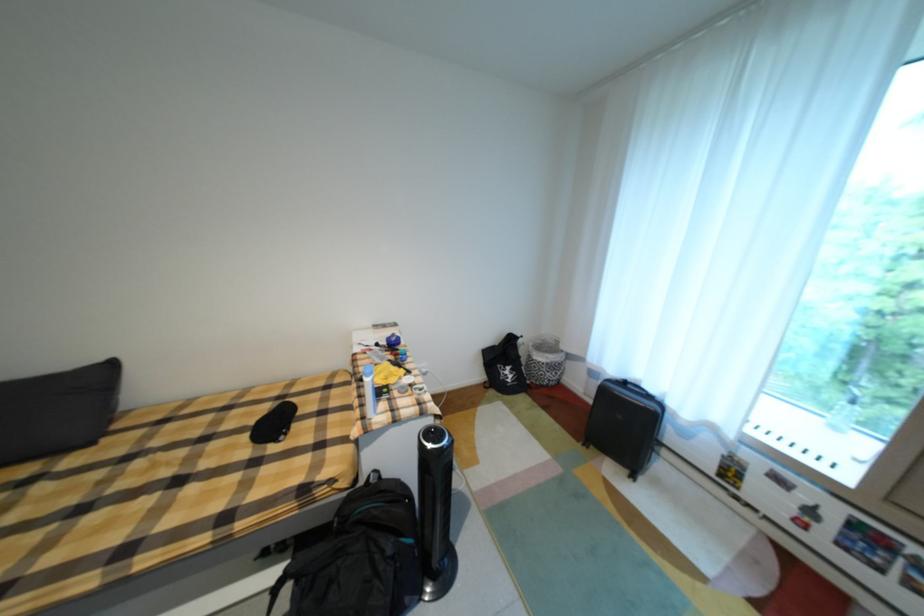
The image size is (924, 616). What do you see at coordinates (543, 361) in the screenshot?
I see `a patterned wastebasket` at bounding box center [543, 361].